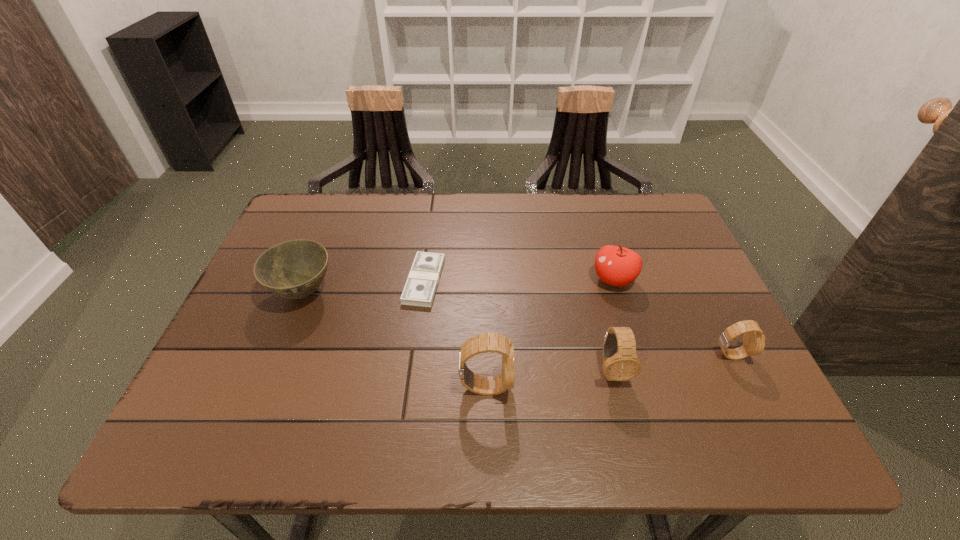
Where is `free region located on the back of the leftmost object`? The height and width of the screenshot is (540, 960). free region located on the back of the leftmost object is located at coordinates (318, 256).

You are a GUI agent. You are given a task and a screenshot of the screen. Output one action in this format:
    pyautogui.click(x=<x>, y=<y>)
    Task: Click on the vacant region located 0.140m on the back of the shortest object
    
    Given the screenshot: What is the action you would take?
    pyautogui.click(x=431, y=225)

This screenshot has height=540, width=960. I want to click on blank space located 0.290m on the left of the apple, so click(x=477, y=280).

I want to click on object that is at the left edge, so 294,269.

Find the location of a particular element. This screenshot has width=960, height=540. object that is at the right edge is located at coordinates (753, 338).

Find the location of a particular element. This screenshot has height=540, width=960. vacant space at the far edge is located at coordinates (484, 238).

You are a GUI agent. You are given a task and a screenshot of the screen. Output one action in this format:
    pyautogui.click(x=<x>, y=<y>)
    Task: Click on the vacant space at the near edge
    
    Given the screenshot: What is the action you would take?
    pyautogui.click(x=666, y=403)

The width and height of the screenshot is (960, 540). In order to click on free spot at the left edge of the desktop in this screenshot , I will do `click(239, 325)`.

At what (x,y) coordinates should I click in order to perform the action: click on vacant position at the right edge of the desktop. Please return your answer as a coordinate pair (x, y). This screenshot has width=960, height=540. Looking at the image, I should click on (667, 299).

This screenshot has height=540, width=960. I want to click on vacant region at the far left corner, so click(334, 219).